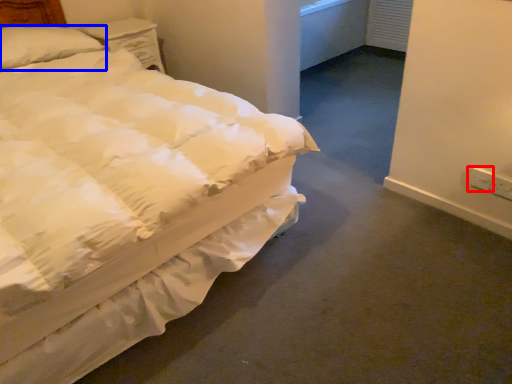
Question: Among these objects, which one is farthest to the camera, electric outlet (highlighted by a red box) or pillow (highlighted by a blue box)?

Choices:
 (A) electric outlet
 (B) pillow

Answer: (B)